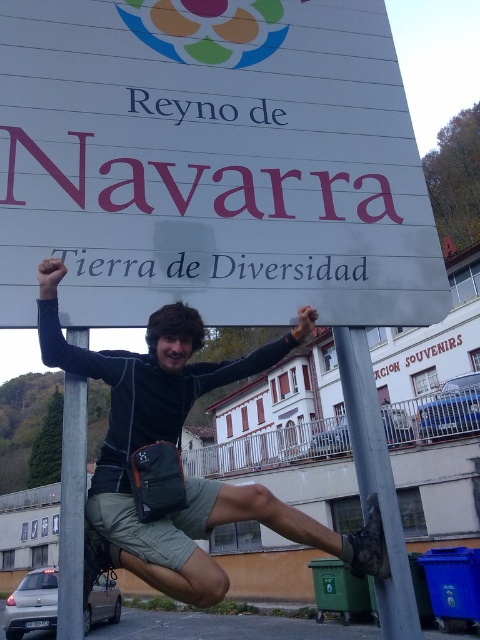
Based on the scene description, can you determine if the white plastic sign at upper center is wider than the metallic pole at lower center?

The white plastic sign at upper center might be wider than the metallic pole at lower center according to the description.

You are a photographer trying to capture the white plastic sign at upper center and the metallic pole at lower center in a single frame. Based on their sizes, which object will appear larger in the photo?

The white plastic sign at upper center will appear larger in the photo because it is much taller than the metallic pole at lower center.

You are standing at the point marked by the coordinate point (375, 480). Which object are you closest to?

You are closest to the metallic pole at lower center because the point (375, 480) represents its location.